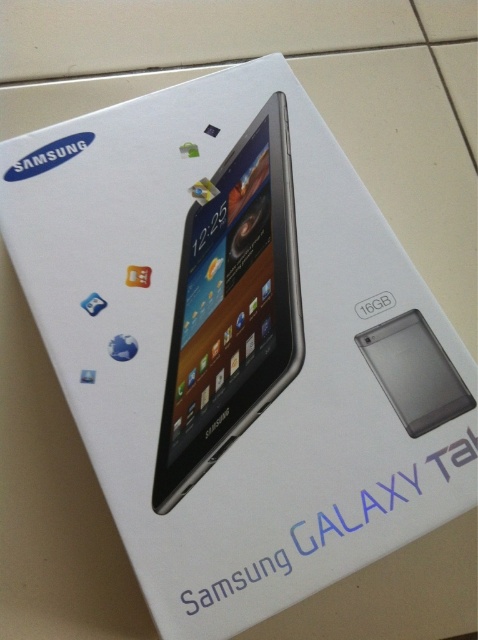
Question: Is silver metallic tablet at center below transparent plastic smartphone at center?

Choices:
 (A) no
 (B) yes

Answer: (A)

Question: Which point is farther from the camera taking this photo?

Choices:
 (A) (428, 337)
 (B) (236, 301)

Answer: (B)

Question: Where is silver metallic tablet at center located in relation to transparent plastic smartphone at center in the image?

Choices:
 (A) below
 (B) above

Answer: (B)

Question: Can you confirm if silver metallic tablet at center is smaller than transparent plastic smartphone at center?

Choices:
 (A) yes
 (B) no

Answer: (B)

Question: Which object is closer to the camera taking this photo?

Choices:
 (A) silver metallic tablet at center
 (B) transparent plastic smartphone at center

Answer: (A)